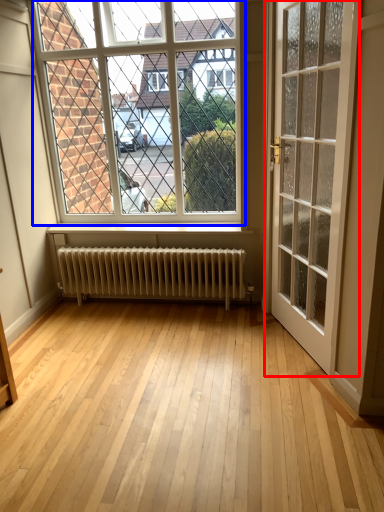
Question: Which point is closer to the camera, door (highlighted by a red box) or window (highlighted by a blue box)?

Choices:
 (A) door
 (B) window

Answer: (A)